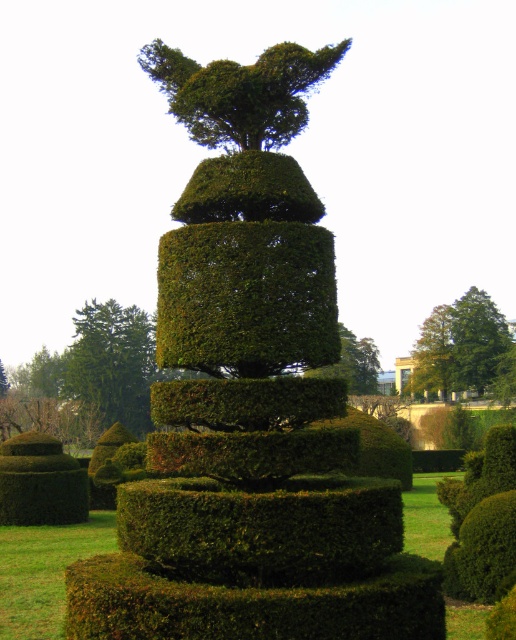
Which is behind, point (88, 349) or point (346, 337)?

Point (346, 337)

Is green leafy tree at left below green leafy bush at center?

Yes.

Find the location of `green leafy tree at left`. green leafy tree at left is located at coordinates (112, 364).

Between green leafy tree at left and green leafy tree at upper center, which one appears on the right side from the viewer's perspective?

green leafy tree at upper center is more to the right.

The image size is (516, 640). Find the location of `green leafy tree at left`. green leafy tree at left is located at coordinates (112, 364).

Who is positioned more to the left, green leafy tree at upper center or green leafy bush at center?

From the viewer's perspective, green leafy bush at center appears more on the left side.

Is point (465, 362) less distant than point (374, 365)?

Yes, point (465, 362) is in front of point (374, 365).

Find the location of `green leafy tree at upper center`. green leafy tree at upper center is located at coordinates (459, 344).